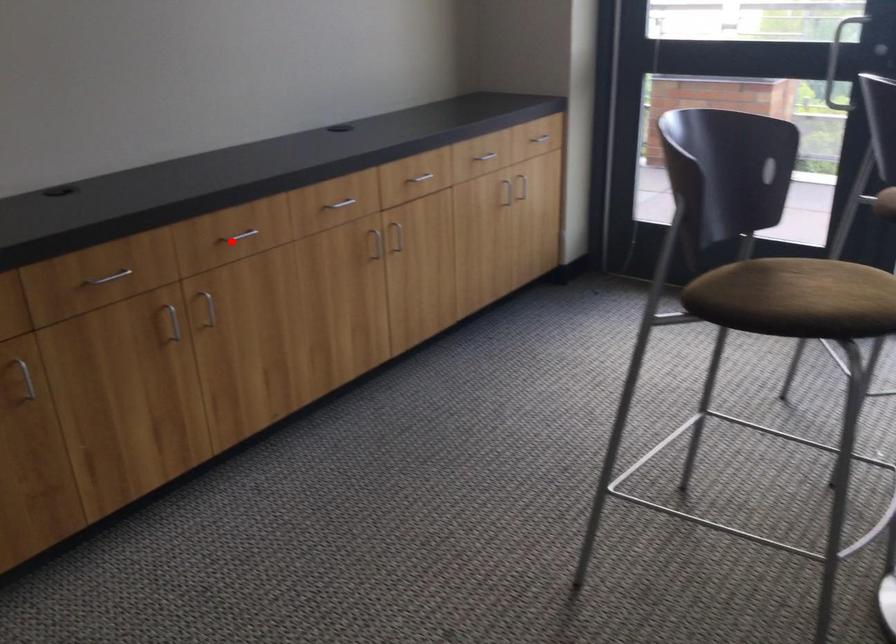
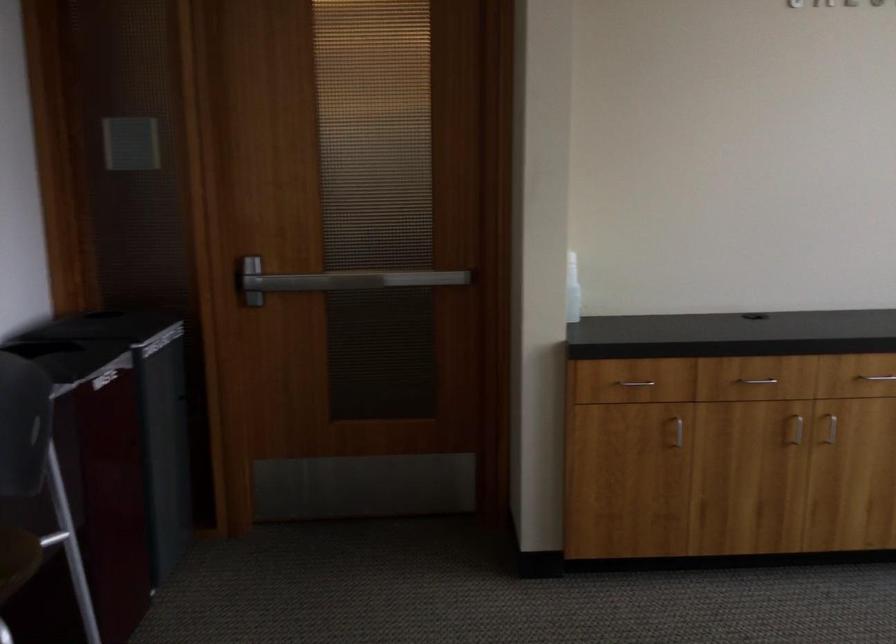
Question: I am providing you with two images of the same scene from different viewpoints. Image1 has a red point marked. In image2, the corresponding 3D location appears at what relative position? Reply with the corresponding letter.

Choices:
 (A) Closer
 (B) Farther

Answer: (B)